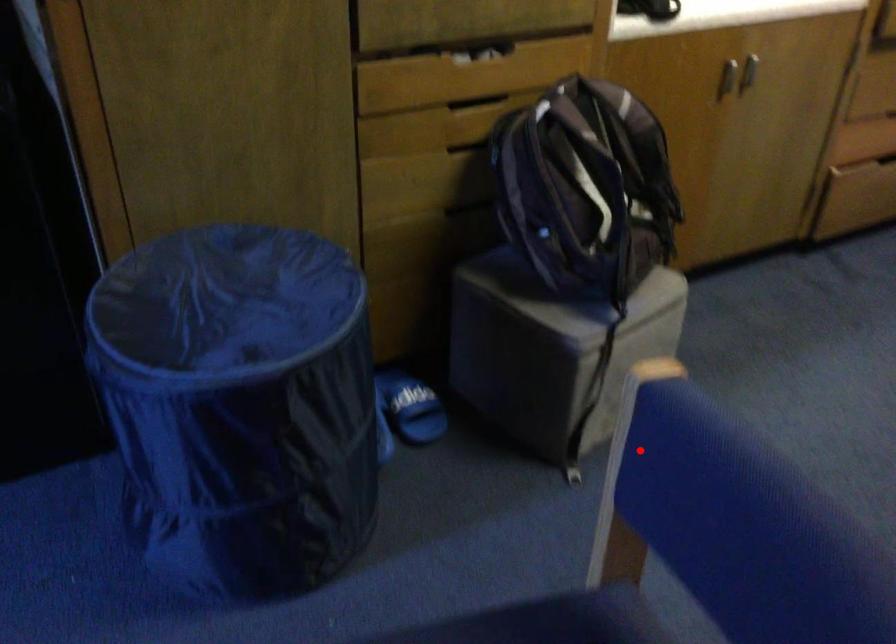
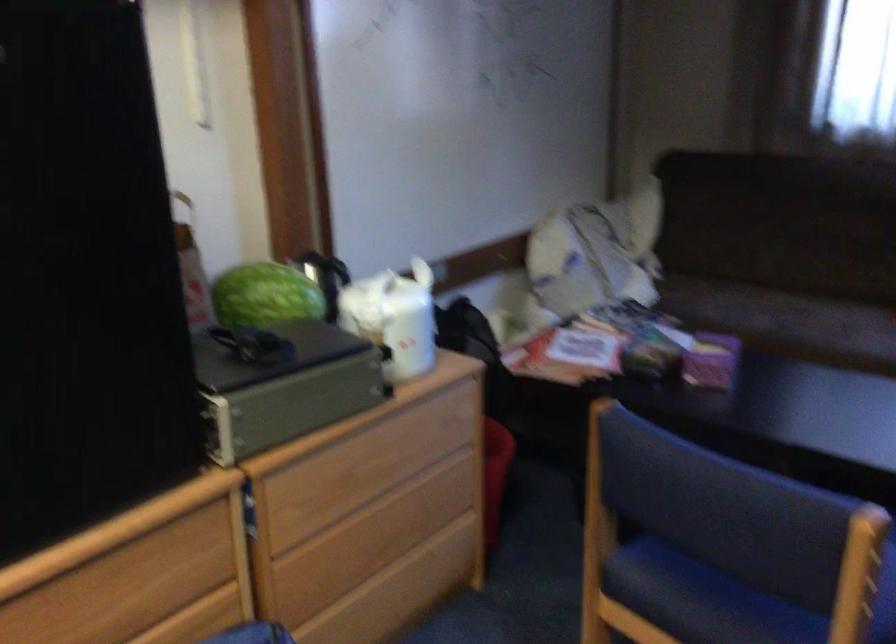
The point at the highlighted location is marked in the first image. Where is the corresponding point in the second image?

(858, 574)